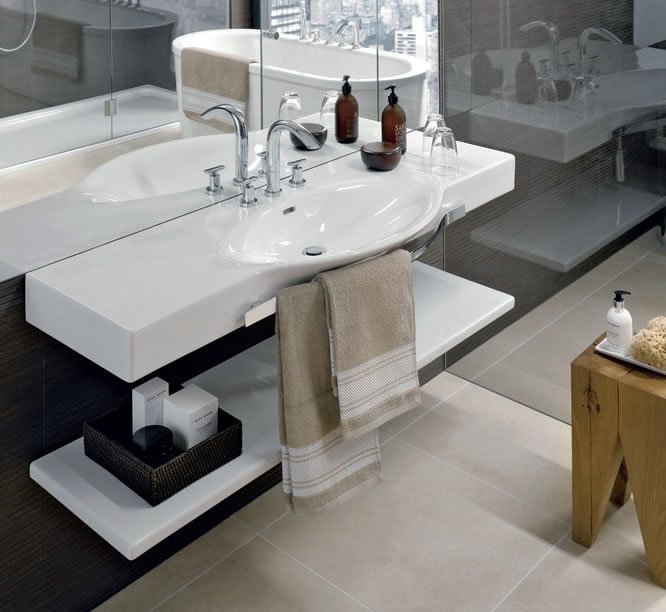
The height and width of the screenshot is (612, 666). I want to click on black wall, so click(33, 401).